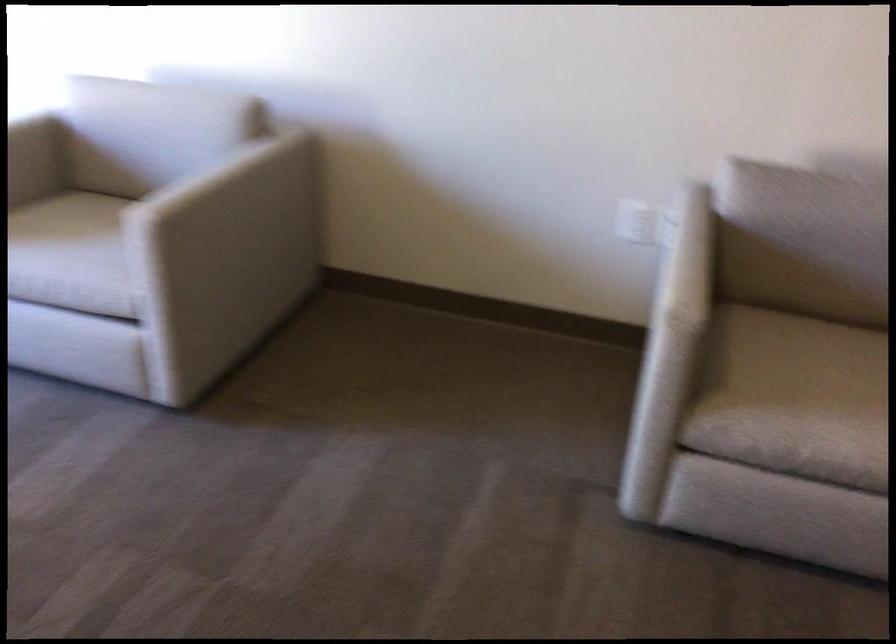
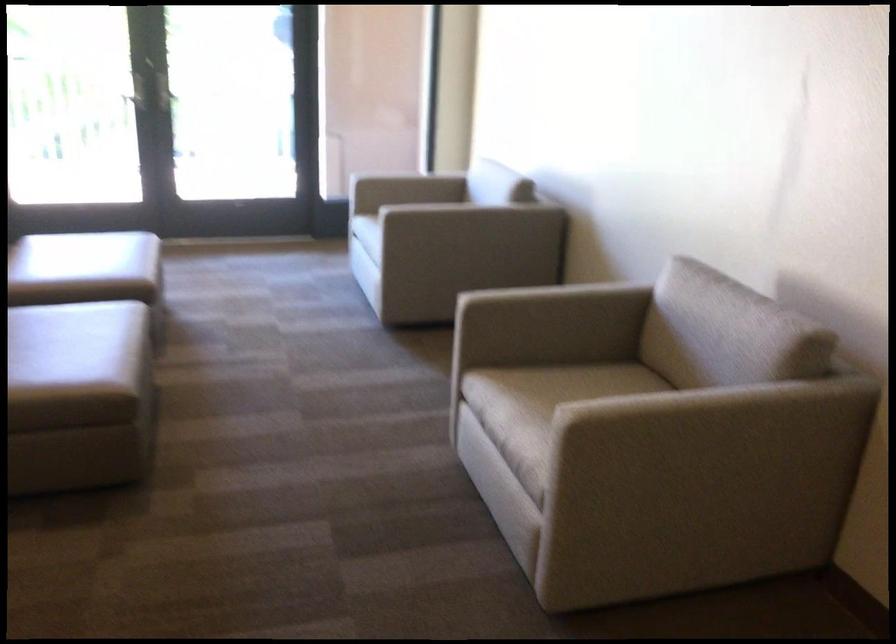
Where in the second image is the point corresponding to the point at 685,259 from the first image?

(533, 287)